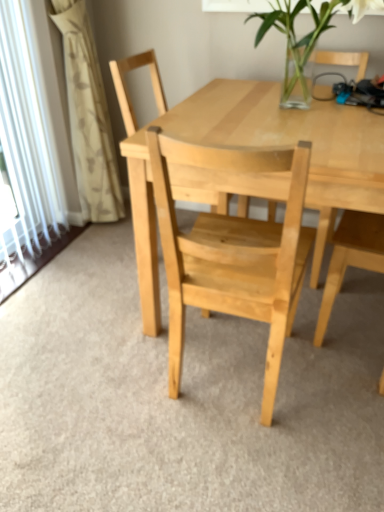
Question: From a real-world perspective, is clear glass vase at upper center located higher than white textured curtain at left?

Choices:
 (A) yes
 (B) no

Answer: (A)

Question: Is clear glass vase at upper center smaller than white textured curtain at left?

Choices:
 (A) no
 (B) yes

Answer: (A)

Question: Considering the relative sizes of clear glass vase at upper center and white textured curtain at left in the image provided, is clear glass vase at upper center bigger than white textured curtain at left?

Choices:
 (A) yes
 (B) no

Answer: (A)

Question: Is the depth of clear glass vase at upper center less than that of white textured curtain at left?

Choices:
 (A) no
 (B) yes

Answer: (B)

Question: From the image's perspective, does clear glass vase at upper center appear higher than white textured curtain at left?

Choices:
 (A) no
 (B) yes

Answer: (B)

Question: Is clear glass vase at upper center wider than white textured curtain at left?

Choices:
 (A) no
 (B) yes

Answer: (B)

Question: Is white textured curtain at left not inside natural wood table at center?

Choices:
 (A) yes
 (B) no

Answer: (A)

Question: Considering the relative sizes of white textured curtain at left and natural wood table at center in the image provided, is white textured curtain at left bigger than natural wood table at center?

Choices:
 (A) yes
 (B) no

Answer: (B)

Question: Is white textured curtain at left surrounding natural wood table at center?

Choices:
 (A) no
 (B) yes

Answer: (A)

Question: Is white textured curtain at left oriented towards natural wood table at center?

Choices:
 (A) yes
 (B) no

Answer: (A)

Question: Is natural wood table at center at the back of white textured curtain at left?

Choices:
 (A) yes
 (B) no

Answer: (B)

Question: Is white textured curtain at left placed right next to natural wood table at center?

Choices:
 (A) yes
 (B) no

Answer: (B)

Question: Is white textured curtain at left at the back of natural wood table at center?

Choices:
 (A) yes
 (B) no

Answer: (B)